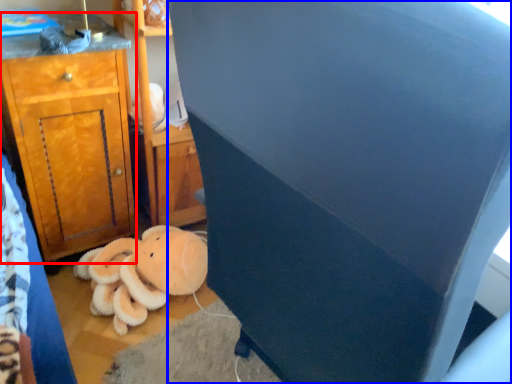
Question: Which object is closer to the camera taking this photo, cabinetry (highlighted by a red box) or furniture (highlighted by a blue box)?

Choices:
 (A) cabinetry
 (B) furniture

Answer: (B)